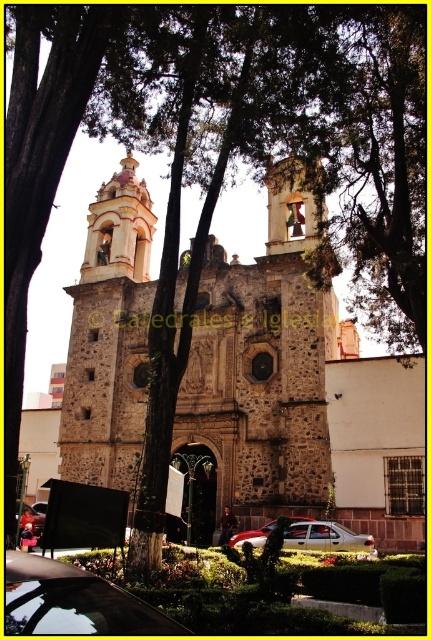
Question: Can you confirm if stone textured church at center is wider than metallic silver car at lower left?

Choices:
 (A) yes
 (B) no

Answer: (A)

Question: Can you confirm if stone textured church at center is smaller than metallic silver car at center?

Choices:
 (A) yes
 (B) no

Answer: (B)

Question: Which object is positioned closest to the metallic silver car at center?

Choices:
 (A) stone textured church at center
 (B) shiny black car at lower left
 (C) red metallic car at center
 (D) matte pink stone bell tower at upper center

Answer: (A)

Question: Which point is closer to the camera?

Choices:
 (A) (12, 556)
 (B) (146, 252)

Answer: (A)

Question: Can you confirm if shiny black car at lower left is wider than metallic silver car at lower left?

Choices:
 (A) yes
 (B) no

Answer: (A)

Question: Estimate the real-world distances between objects in this image. Which object is farther from the stone textured church at center?

Choices:
 (A) shiny black car at lower left
 (B) red metallic car at center
 (C) matte pink stone bell tower at upper center
 (D) metallic silver car at center

Answer: (A)